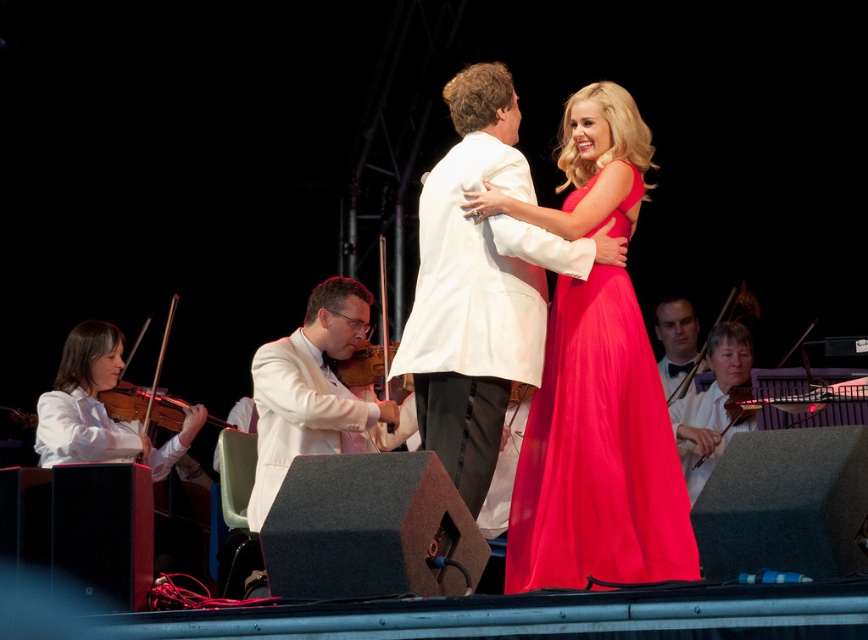
You are a photographer in the audience at this concert. You want to take a photo that includes both the white glossy violinist at center and the white satin violin at lower right. Which object should you focus on first if you want to ensure both are in sharp focus?

The white glossy violinist at center is much taller than the white satin violin at lower right, so you should focus on the white glossy violinist at center first to ensure both are in sharp focus.

Looking at this image, you are a photographer standing at the camera position. The white glossy violinist at center is your main subject. You want to take a closeup shot of the violinist. Do you think you can get a clear closeup without moving the camera?

The white glossy violinist at center is 6.44 meters from the camera. To capture a clear closeup without moving the camera, you would need a lens with sufficient zoom capability to focus on the subject from that distance. The distance itself doesn not prevent a clear shot, but the camera equipment determines success.